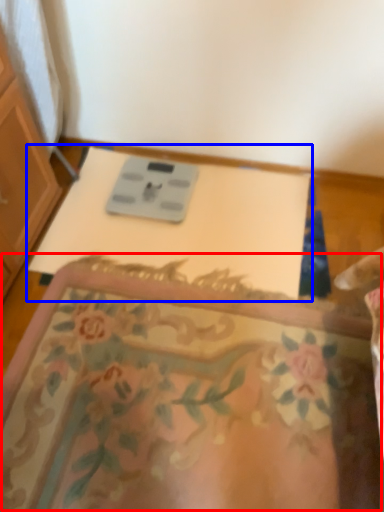
Question: Which of the following is the farthest to the observer, mat (highlighted by a red box) or changing table (highlighted by a blue box)?

Choices:
 (A) mat
 (B) changing table

Answer: (B)